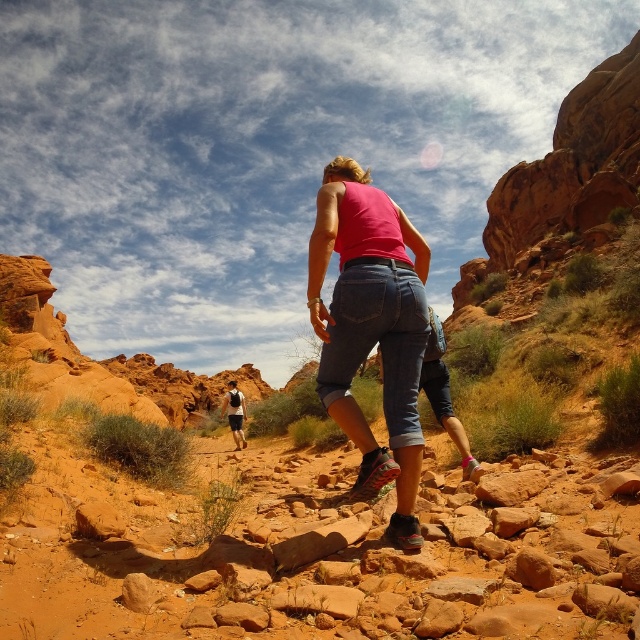
The image size is (640, 640). In order to click on matte pink tank top at center in this screenshot , I will do `click(371, 328)`.

Who is positioned more to the right, matte pink tank top at center or white mesh shirt at center?

Positioned to the right is matte pink tank top at center.

Measure the distance between point (356, 417) and camera.

The distance of point (356, 417) from camera is 44.99 meters.

What are the coordinates of `matte pink tank top at center` in the screenshot? It's located at tap(371, 328).